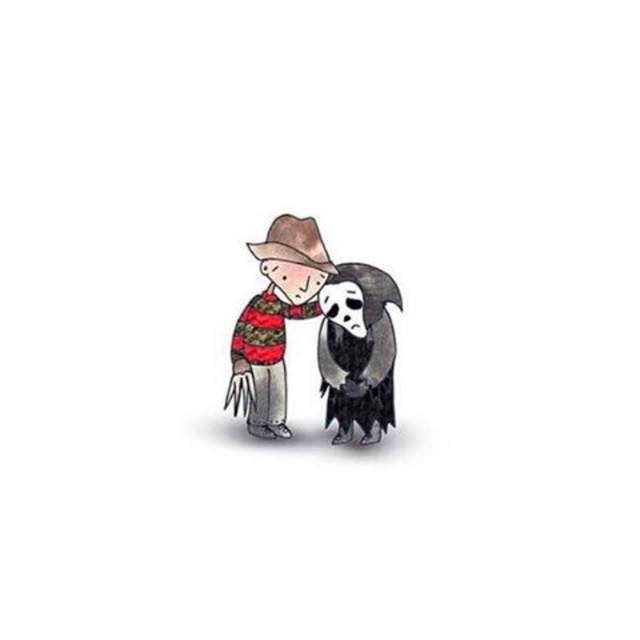
Between black matte ghost at lower right and brown felt cowboy hat at upper center, which one is positioned higher?

brown felt cowboy hat at upper center is higher up.

Does black matte ghost at lower right appear under brown felt cowboy hat at upper center?

Indeed, black matte ghost at lower right is positioned under brown felt cowboy hat at upper center.

Is point (321, 328) in front of point (301, 241)?

No, (321, 328) is further to viewer.

Locate an element on the screen. The width and height of the screenshot is (640, 640). black matte ghost at lower right is located at coordinates (356, 349).

Who is taller, striped sweater at center or brown felt cowboy hat at upper center?

Standing taller between the two is striped sweater at center.

Is striped sweater at center further to camera compared to brown felt cowboy hat at upper center?

That is True.

Does point (296, 266) come behind point (310, 220)?

No, it is not.

The height and width of the screenshot is (640, 640). Find the location of `striped sweater at center`. striped sweater at center is located at coordinates (275, 321).

Can you confirm if striped sweater at center is shorter than black matte ghost at lower right?

No.

Does striped sweater at center appear on the right side of black matte ghost at lower right?

No, striped sweater at center is not to the right of black matte ghost at lower right.

Is point (268, 388) more distant than point (356, 298)?

Yes, it is behind point (356, 298).

Image resolution: width=640 pixels, height=640 pixels. Identify the location of striped sweater at center. (275, 321).